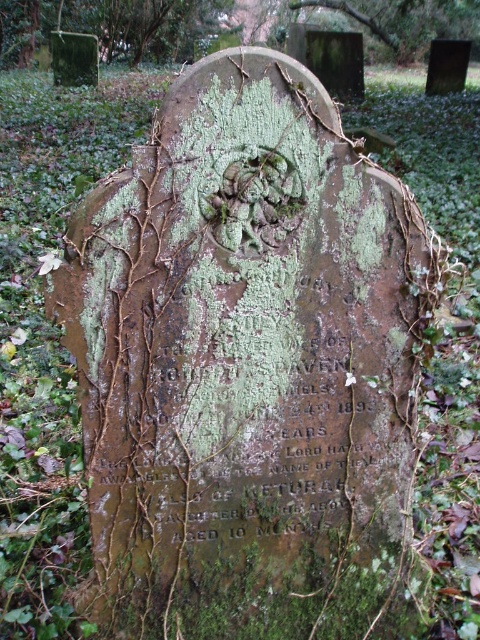
You are standing in a cemetery and see a gravestone with an engraved design at its top center. There is also a green mossy tree at upper center. Where is the point located at coordinates (x=108, y=26) in relation to these two objects?

The point located at coordinates (x=108, y=26) corresponds to the green mossy tree at upper center.

You are a gardener trying to trim the green mossy tree at upper center and the green mossy gravestone at upper center. Which one requires a taller ladder to reach its top?

The green mossy tree at upper center is bigger than the green mossy gravestone at upper center, so you will need a taller ladder to reach the top of the green mossy tree at upper center.